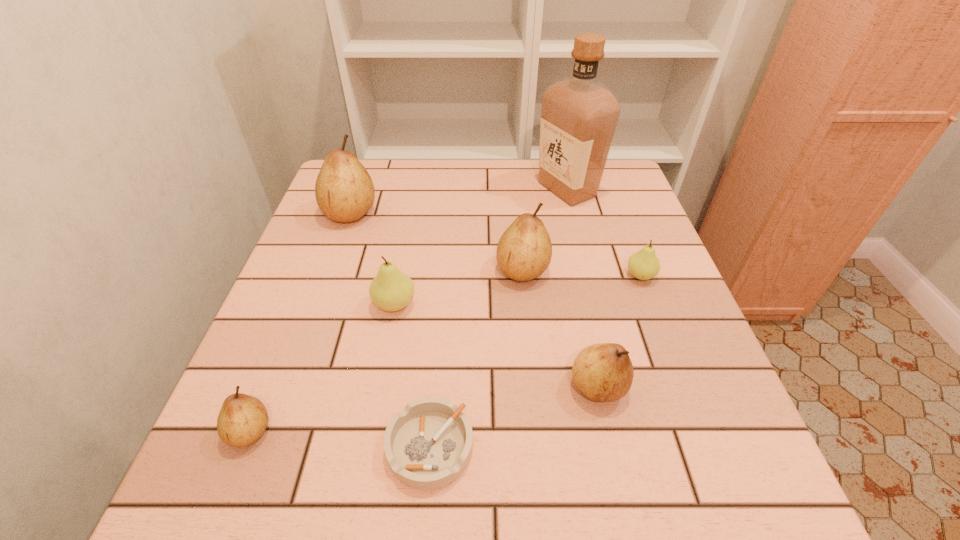
Locate an element on the screen. This screenshot has width=960, height=540. empty location between the tallest object and the tallest pear is located at coordinates (459, 201).

At what (x,y) coordinates should I click in order to perform the action: click on free space between the left green pear and the second tallest pear. Please return your answer as a coordinate pair (x, y). Image resolution: width=960 pixels, height=540 pixels. Looking at the image, I should click on (459, 287).

Locate an element on the screen. This screenshot has height=540, width=960. vacant space that's between the tallest pear and the tallest object is located at coordinates point(459,201).

The width and height of the screenshot is (960, 540). I want to click on free space between the tallest pear and the smallest brown pear, so click(300, 322).

Identify the location of vacant area between the farthest brown pear and the liquor. Image resolution: width=960 pixels, height=540 pixels. (459, 201).

I want to click on the third closest object to the smallest brown pear, so click(524, 251).

Locate which object is the fifth closest to the rightmost pear. Please provide its 2D coordinates. Your answer should be formatted as a tuple, i.e. [(x, y)], where the tuple contains the x and y coordinates of a point satisfying the conditions above.

[(391, 290)]

Find the location of a particular element. The width and height of the screenshot is (960, 540). pear object that ranks as the fourth closest to the tallest object is located at coordinates (344, 191).

Where is `pear that is the third closest to the brown liquor`? pear that is the third closest to the brown liquor is located at coordinates (391, 290).

At what (x,y) coordinates should I click in order to perform the action: click on the third closest brown pear relative to the second biggest brown pear. Please return your answer as a coordinate pair (x, y). Image resolution: width=960 pixels, height=540 pixels. Looking at the image, I should click on (242, 420).